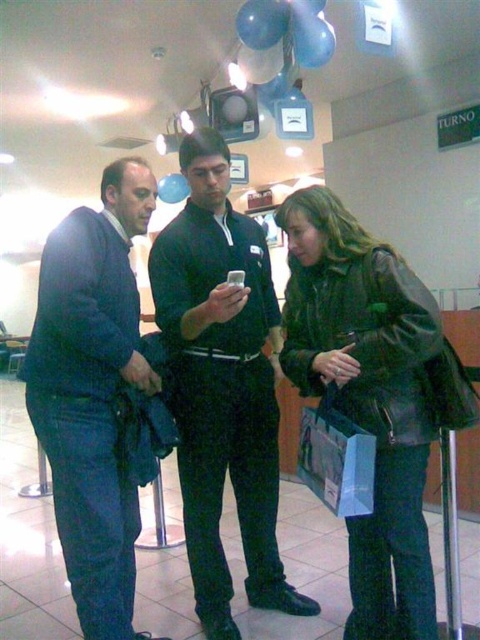
Question: Can you confirm if leather jacket at lower right is positioned above dark blue jeans at center?

Choices:
 (A) no
 (B) yes

Answer: (A)

Question: Estimate the real-world distances between objects in this image. Which object is closer to the leather jacket at lower right?

Choices:
 (A) dark blue jeans at center
 (B) black smooth shirt at center

Answer: (B)

Question: Is leather jacket at lower right further to camera compared to dark blue jeans at center?

Choices:
 (A) yes
 (B) no

Answer: (B)

Question: Which of the following is the farthest from the observer?

Choices:
 (A) (132, 173)
 (B) (241, 515)
 (C) (361, 244)

Answer: (B)

Question: Which object is positioned farthest from the leather jacket at lower right?

Choices:
 (A) dark blue jeans at center
 (B) black smooth shirt at center

Answer: (A)

Question: Is black smooth shirt at center positioned behind leather jacket at lower right?

Choices:
 (A) yes
 (B) no

Answer: (A)